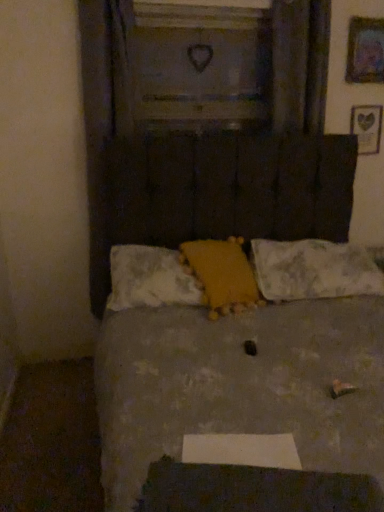
Describe the element at coordinates (367, 127) in the screenshot. I see `wooden heart at upper right, positioned as the second picture frame in top-to-bottom order` at that location.

What are the coordinates of `wooden picture frame at upper right, which is counted as the 1th picture frame, starting from the front` in the screenshot? It's located at (365, 51).

Where is `textured gray bed at center`? textured gray bed at center is located at coordinates (238, 382).

Is textured gray bed at center positioned in front of white textured pillow at center, marked as the 3th pillow in a left-to-right arrangement?

Yes, it is in front of white textured pillow at center, marked as the 3th pillow in a left-to-right arrangement.

Can you confirm if textured gray bed at center is taller than white textured pillow at center, which is the 1th pillow from right to left?

Indeed, textured gray bed at center has a greater height compared to white textured pillow at center, which is the 1th pillow from right to left.

Looking at this image, is textured gray bed at center outside of white textured pillow at center, which is the 1th pillow from right to left?

Yes, textured gray bed at center is located beyond the bounds of white textured pillow at center, which is the 1th pillow from right to left.

Does yellow fabric pillow at center, which is counted as the first pillow, starting from the left, appear on the right side of textured gray bed at center?

Incorrect, yellow fabric pillow at center, which is counted as the first pillow, starting from the left, is not on the right side of textured gray bed at center.

Considering the sizes of objects yellow fabric pillow at center, which is counted as the first pillow, starting from the left, and textured gray bed at center in the image provided, who is smaller, yellow fabric pillow at center, which is counted as the first pillow, starting from the left, or textured gray bed at center?

yellow fabric pillow at center, which is counted as the first pillow, starting from the left.

Would you consider yellow fabric pillow at center, which is counted as the first pillow, starting from the left, to be distant from textured gray bed at center?

No, yellow fabric pillow at center, which is counted as the first pillow, starting from the left, is not far away from textured gray bed at center.

Would you say wooden picture frame at upper right, acting as the 1th picture frame starting from the top, is outside wooden heart at upper right, the 2th picture frame from the front?

Yes.

How much distance is there between wooden picture frame at upper right, acting as the 1th picture frame starting from the top, and wooden heart at upper right, the 2th picture frame from the front?

wooden picture frame at upper right, acting as the 1th picture frame starting from the top, is 11.80 inches from wooden heart at upper right, the 2th picture frame from the front.

Is wooden picture frame at upper right, acting as the second picture frame starting from the bottom, not near wooden heart at upper right, positioned as the second picture frame in top-to-bottom order?

No, wooden picture frame at upper right, acting as the second picture frame starting from the bottom, is in close proximity to wooden heart at upper right, positioned as the second picture frame in top-to-bottom order.

From the image's perspective, is wooden picture frame at upper right, acting as the 1th picture frame starting from the top, beneath wooden heart at upper right, the 1th picture frame in the bottom-to-top sequence?

No.

Which object is closer to the camera taking this photo, yellow plush at center, acting as the second pillow starting from the left, or wooden picture frame at upper right, the second picture frame from the back?

yellow plush at center, acting as the second pillow starting from the left, is closer to the camera.

Is yellow plush at center, acting as the second pillow starting from the left, positioned with its back to wooden picture frame at upper right, acting as the 1th picture frame starting from the top?

No, yellow plush at center, acting as the second pillow starting from the left,'s orientation is not away from wooden picture frame at upper right, acting as the 1th picture frame starting from the top.

Consider the image. From a real-world perspective, is yellow plush at center, which ranks as the 2th pillow in right-to-left order, positioned above or below wooden picture frame at upper right, which is counted as the 1th picture frame, starting from the front?

yellow plush at center, which ranks as the 2th pillow in right-to-left order, is below wooden picture frame at upper right, which is counted as the 1th picture frame, starting from the front.

Can you tell me how much yellow plush at center, which ranks as the 2th pillow in right-to-left order, and wooden picture frame at upper right, acting as the 1th picture frame starting from the top, differ in facing direction?

yellow plush at center, which ranks as the 2th pillow in right-to-left order, and wooden picture frame at upper right, acting as the 1th picture frame starting from the top, are facing 16.3 degrees away from each other.

Between yellow plush at center, acting as the second pillow starting from the left, and wooden heart at upper right, positioned as the second picture frame in top-to-bottom order, which one has smaller width?

With smaller width is wooden heart at upper right, positioned as the second picture frame in top-to-bottom order.

Consider the image. Is yellow plush at center, acting as the second pillow starting from the left, placed right next to wooden heart at upper right, the 1th picture frame in the back-to-front sequence?

No, yellow plush at center, acting as the second pillow starting from the left, is not with wooden heart at upper right, the 1th picture frame in the back-to-front sequence.

Which object is positioned more to the left, yellow plush at center, which ranks as the 2th pillow in right-to-left order, or wooden heart at upper right, positioned as the second picture frame in top-to-bottom order?

yellow plush at center, which ranks as the 2th pillow in right-to-left order.

Which is closer to the camera, (230, 306) or (361, 120)?

Point (230, 306) appears to be closer to the viewer than point (361, 120).

From a real-world perspective, who is located higher, wooden picture frame at upper right, the second picture frame from the back, or textured gray bed at center?

In real-world perspective, wooden picture frame at upper right, the second picture frame from the back, is above.

Are wooden picture frame at upper right, the second picture frame from the back, and textured gray bed at center making contact?

wooden picture frame at upper right, the second picture frame from the back, and textured gray bed at center are clearly separated.

Does point (383, 26) come closer to viewer compared to point (229, 151)?

No, (383, 26) is further to viewer.

Is wooden picture frame at upper right, acting as the second picture frame starting from the bottom, looking in the opposite direction of textured gray bed at center?

No, textured gray bed at center is not at the back of wooden picture frame at upper right, acting as the second picture frame starting from the bottom.

How many degrees apart are the facing directions of wooden heart at upper right, positioned as the second picture frame in top-to-bottom order, and yellow plush at center, which ranks as the 2th pillow in right-to-left order?

15.8 degrees.

Considering their positions, is wooden heart at upper right, the 1th picture frame in the bottom-to-top sequence, located in front of or behind yellow plush at center, which ranks as the 2th pillow in right-to-left order?

wooden heart at upper right, the 1th picture frame in the bottom-to-top sequence, is positioned farther from the viewer than yellow plush at center, which ranks as the 2th pillow in right-to-left order.

You are a GUI agent. You are given a task and a screenshot of the screen. Output one action in this format:
    pyautogui.click(x=<x>, y=<y>)
    Task: Click on the 2nd pillow to the left of the wooden heart at upper right, the 1th picture frame in the back-to-front sequence, counting from the anchor's position
    
    Given the screenshot: What is the action you would take?
    pyautogui.click(x=222, y=275)

Is there a large distance between wooden heart at upper right, the 1th picture frame in the back-to-front sequence, and yellow plush at center, which ranks as the 2th pillow in right-to-left order?

Absolutely, wooden heart at upper right, the 1th picture frame in the back-to-front sequence, is distant from yellow plush at center, which ranks as the 2th pillow in right-to-left order.

From the textured gray bed at center, count 3rd pillows backward and point to it. Please provide its 2D coordinates.

[(315, 269)]

Locate an element on the screen. The image size is (384, 512). bed below the yellow fabric pillow at center, which is counted as the third pillow, starting from the right (from a real-world perspective) is located at coordinates (238, 382).

Looking at the image, which one is located closer to wooden heart at upper right, the 1th picture frame in the bottom-to-top sequence, wooden picture frame at upper right, which is counted as the 1th picture frame, starting from the front, or textured gray bed at center?

wooden picture frame at upper right, which is counted as the 1th picture frame, starting from the front, is positioned closer to the anchor wooden heart at upper right, the 1th picture frame in the bottom-to-top sequence.

Which object lies nearer to the anchor point yellow plush at center, acting as the second pillow starting from the left, textured gray bed at center or yellow fabric pillow at center, which is counted as the first pillow, starting from the left?

yellow fabric pillow at center, which is counted as the first pillow, starting from the left.

Looking at the image, which one is located further to yellow plush at center, acting as the second pillow starting from the left, white textured pillow at center, marked as the 3th pillow in a left-to-right arrangement, or wooden heart at upper right, the 1th picture frame in the bottom-to-top sequence?

The object further to yellow plush at center, acting as the second pillow starting from the left, is wooden heart at upper right, the 1th picture frame in the bottom-to-top sequence.

From the image, which object appears to be nearer to wooden picture frame at upper right, acting as the second picture frame starting from the bottom, white textured pillow at center, which is the 1th pillow from right to left, or yellow fabric pillow at center, which is counted as the first pillow, starting from the left?

white textured pillow at center, which is the 1th pillow from right to left, is positioned closer to the anchor wooden picture frame at upper right, acting as the second picture frame starting from the bottom.

Based on the photo, based on their spatial positions, is wooden picture frame at upper right, acting as the 1th picture frame starting from the top, or wooden heart at upper right, the 1th picture frame in the back-to-front sequence, further from yellow plush at center, acting as the second pillow starting from the left?

wooden picture frame at upper right, acting as the 1th picture frame starting from the top, is further to yellow plush at center, acting as the second pillow starting from the left.

Considering their positions, is yellow plush at center, acting as the second pillow starting from the left, positioned further to wooden picture frame at upper right, the second picture frame from the back, than white textured pillow at center, which is the 1th pillow from right to left?

yellow plush at center, acting as the second pillow starting from the left.

Estimate the real-world distances between objects in this image. Which object is further from yellow plush at center, acting as the second pillow starting from the left, wooden heart at upper right, the 1th picture frame in the bottom-to-top sequence, or yellow fabric pillow at center, which is counted as the third pillow, starting from the right?

wooden heart at upper right, the 1th picture frame in the bottom-to-top sequence, is further to yellow plush at center, acting as the second pillow starting from the left.

From the image, which object appears to be nearer to yellow fabric pillow at center, which is counted as the first pillow, starting from the left, textured gray bed at center or yellow plush at center, which ranks as the 2th pillow in right-to-left order?

yellow plush at center, which ranks as the 2th pillow in right-to-left order, is positioned closer to the anchor yellow fabric pillow at center, which is counted as the first pillow, starting from the left.

Image resolution: width=384 pixels, height=512 pixels. Find the location of `pillow between yellow fabric pillow at center, which is counted as the first pillow, starting from the left, and white textured pillow at center, marked as the 3th pillow in a left-to-right arrangement, from left to right`. pillow between yellow fabric pillow at center, which is counted as the first pillow, starting from the left, and white textured pillow at center, marked as the 3th pillow in a left-to-right arrangement, from left to right is located at coordinates [x=222, y=275].

You are a GUI agent. You are given a task and a screenshot of the screen. Output one action in this format:
    pyautogui.click(x=<x>, y=<y>)
    Task: Click on the pillow between wooden picture frame at upper right, acting as the 1th picture frame starting from the top, and yellow plush at center, which ranks as the 2th pillow in right-to-left order, in the up-down direction
    This screenshot has height=512, width=384.
    Given the screenshot: What is the action you would take?
    pyautogui.click(x=315, y=269)

The height and width of the screenshot is (512, 384). I want to click on pillow between wooden heart at upper right, the 2th picture frame from the front, and yellow plush at center, which ranks as the 2th pillow in right-to-left order, in the vertical direction, so click(x=315, y=269).

The height and width of the screenshot is (512, 384). I want to click on picture frame between textured gray bed at center and wooden heart at upper right, the 2th picture frame from the front, along the z-axis, so click(x=365, y=51).